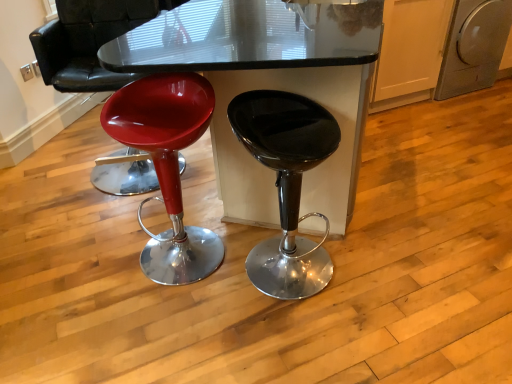
Find the location of a particular element. blank space to the left of glossy plastic stool at left, which is the 2th stool in right-to-left order is located at coordinates (92, 288).